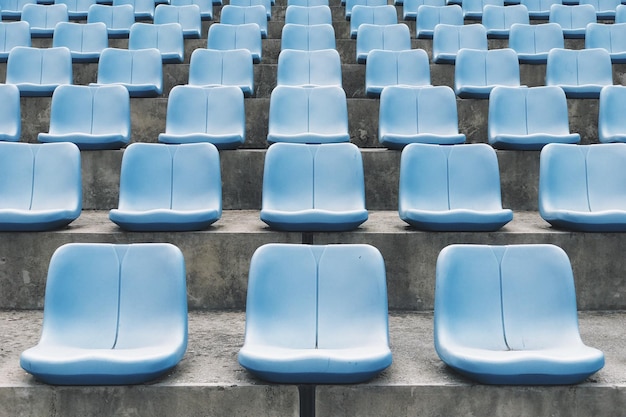
The width and height of the screenshot is (626, 417). What are the coordinates of `eight seats closest to the viewer` in the screenshot? It's located at (116, 293), (310, 294), (511, 297), (577, 199), (324, 197), (443, 194), (178, 187), (44, 189).